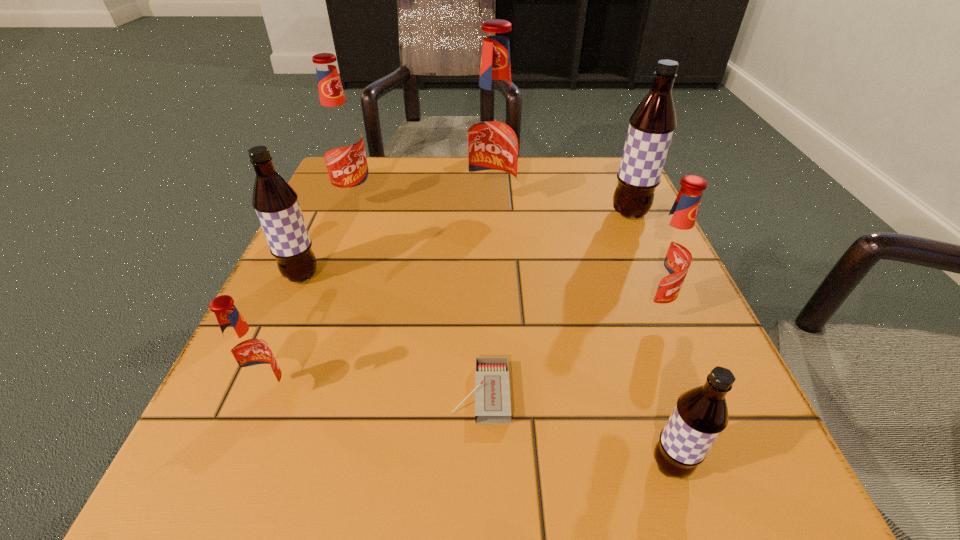
Identify the location of the smallest red root beer. The height and width of the screenshot is (540, 960). (248, 355).

You are a GUI agent. You are given a task and a screenshot of the screen. Output one action in this format:
    pyautogui.click(x=<x>, y=<y>)
    Task: Click on the smallest brown root beer
    This screenshot has width=960, height=540.
    Given the screenshot: What is the action you would take?
    pyautogui.click(x=701, y=414)

Where is `the nearest brown root beer`? The width and height of the screenshot is (960, 540). the nearest brown root beer is located at coordinates (701, 414).

You are a GUI agent. You are given a task and a screenshot of the screen. Output one action in this format:
    pyautogui.click(x=<x>, y=<y>)
    Task: Click on the matchbox
    This screenshot has width=960, height=540.
    Given the screenshot: What is the action you would take?
    pyautogui.click(x=492, y=388)

Locate an element on the screen. Image resolution: width=960 pixels, height=540 pixels. the shortest object is located at coordinates (492, 388).

Locate an element on the screen. Image resolution: width=960 pixels, height=540 pixels. vacant space located on the front of the tallest root beer is located at coordinates (498, 354).

This screenshot has width=960, height=540. Identify the location of free region located 0.070m on the right of the second biggest red root beer. (406, 202).

I want to click on free space located 0.190m on the front of the rightmost brown root beer, so click(663, 289).

You are a GUI agent. You are given a task and a screenshot of the screen. Output one action in this format:
    pyautogui.click(x=<x>, y=<y>)
    Task: Click on the vacant space located 0.250m on the front of the second smallest brown root beer
    
    Given the screenshot: What is the action you would take?
    pyautogui.click(x=236, y=421)

Where is `free region located on the left of the fourth nearest object`? The height and width of the screenshot is (540, 960). free region located on the left of the fourth nearest object is located at coordinates (390, 309).